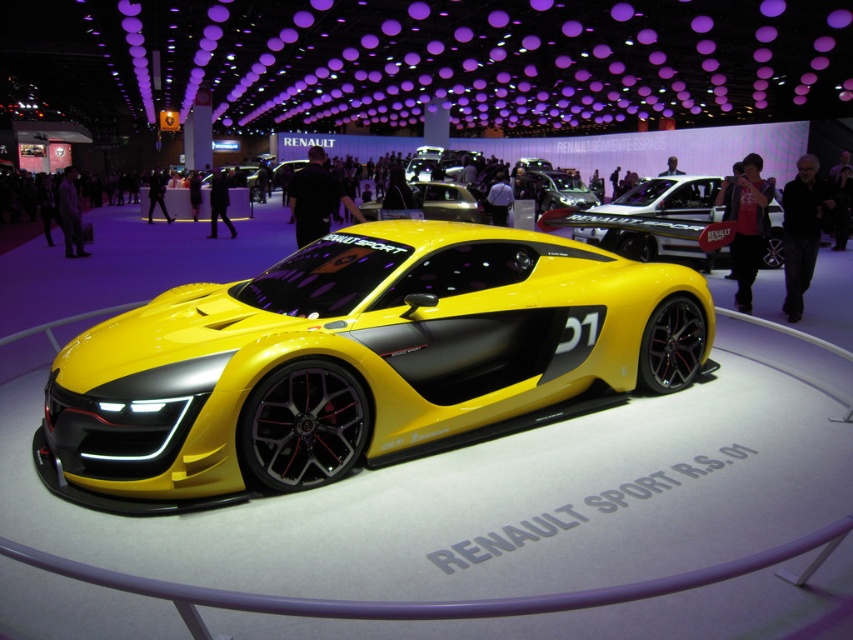
From the picture: Which of these two, yellow matte/satin sports car at center or yellow matte/soft-touch concept car at center, stands shorter?

yellow matte/soft-touch concept car at center is shorter.

Is point (79, 365) in front of point (647, 182)?

That is True.

Is point (659, 355) in front of point (582, 232)?

Yes, it is in front of point (582, 232).

Identify the location of yellow matte/satin sports car at center. (363, 358).